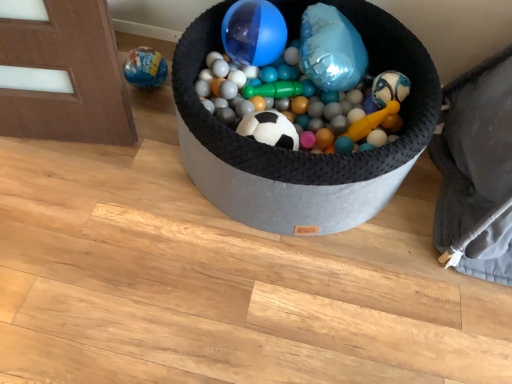
What do you see at coordinates (334, 79) in the screenshot?
I see `matte black soccer ball at center` at bounding box center [334, 79].

What is the approximate height of matte black soccer ball at center?

matte black soccer ball at center is 25.73 centimeters tall.

Where is `matte black soccer ball at center`? The height and width of the screenshot is (384, 512). matte black soccer ball at center is located at coordinates (334, 79).

I want to click on matte black soccer ball at center, so click(334, 79).